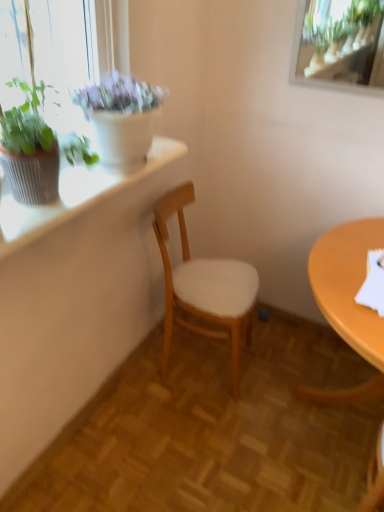
The image size is (384, 512). In order to click on blank space above textured white window sill at upper left (from a real-world perspective) in this screenshot , I will do `click(84, 187)`.